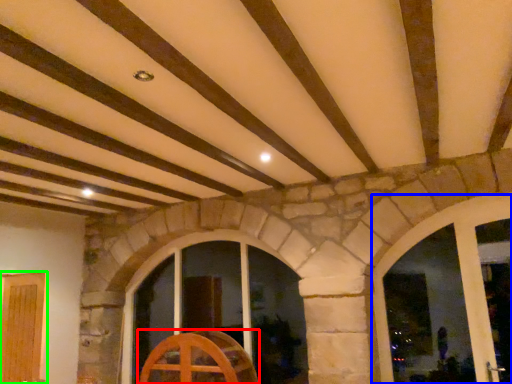
Question: Which object is positioned closest to furniture (highlighted by a red box)? Select from window (highlighted by a blue box) and door (highlighted by a green box).

Choices:
 (A) window
 (B) door

Answer: (B)